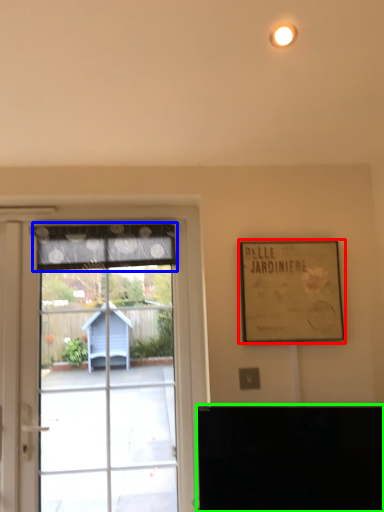
Question: Which object is the closest to the picture frame (highlighted by a red box)? Choose among these: curtain (highlighted by a blue box) or furniture (highlighted by a green box).

Choices:
 (A) curtain
 (B) furniture

Answer: (B)